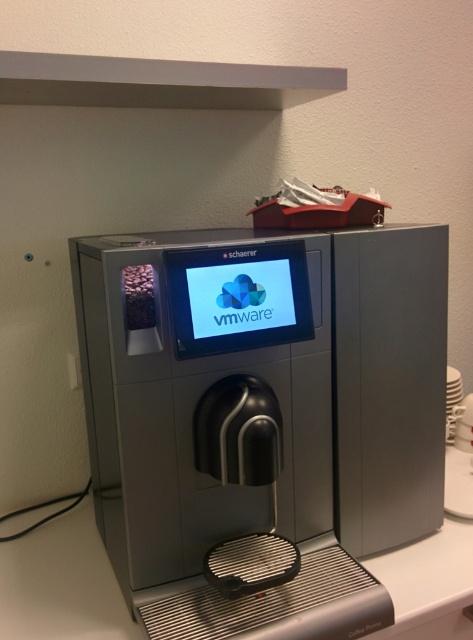
Is satin silver coffee machine at center wider than white glossy counter top at center?

Correct, the width of satin silver coffee machine at center exceeds that of white glossy counter top at center.

Does point (270, 440) come farther from viewer compared to point (456, 636)?

No, it is in front of (456, 636).

Locate an element on the screen. satin silver coffee machine at center is located at coordinates (260, 406).